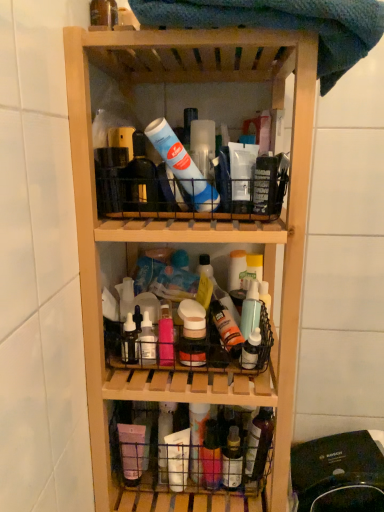
Question: Relative to black plastic vacuum cleaner at lower right, is translucent plastic spray bottle at center, which appears as the fifth bottle when viewed from the left, in front or behind?

Choices:
 (A) front
 (B) behind

Answer: (B)

Question: From a real-world perspective, is translucent plastic spray bottle at center, which ranks as the 2th bottle in top-to-bottom order, above or below black plastic vacuum cleaner at lower right?

Choices:
 (A) above
 (B) below

Answer: (A)

Question: Considering the real-world distances, which object is closest to the translucent plastic spray bottle at center, which is the 1th bottle in right-to-left order?

Choices:
 (A) white matte bottle at center, the second bottle positioned from the bottom
 (B) translucent plastic basket at lower center
 (C) black plastic vacuum cleaner at lower right
 (D) translucent plastic bottle at upper left, which is the 5th bottle from right to left
 (E) translucent plastic bottle at center, which appears as the 3th bottle when viewed from the left

Answer: (E)

Question: Considering the real-world distances, which object is farthest from the white matte bottle at center, the second bottle positioned from the bottom?

Choices:
 (A) translucent plastic basket at lower center
 (B) black plastic vacuum cleaner at lower right
 (C) translucent plastic bottle at center, the first bottle ordered from the bottom
 (D) translucent plastic spray bottle at center, which ranks as the 2th bottle in top-to-bottom order
 (E) matte plastic bottles at center

Answer: (B)